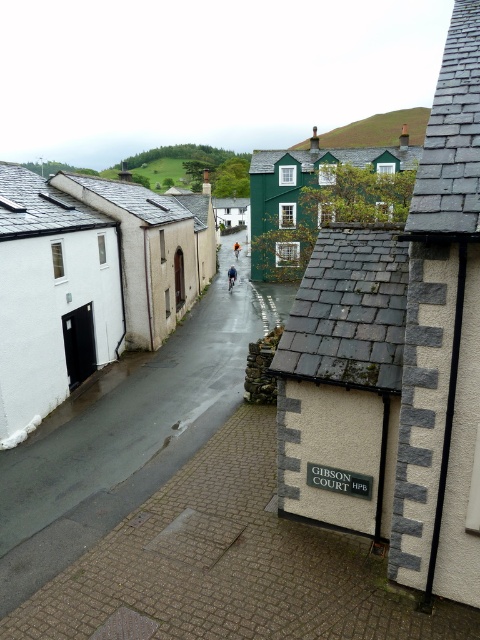
Question: Does blue fabric jacket at center lie behind orange fabric jacket at center?

Choices:
 (A) yes
 (B) no

Answer: (B)

Question: In this image, where is smooth asphalt road at center located relative to orange fabric jacket at center?

Choices:
 (A) right
 (B) left

Answer: (A)

Question: Which object is positioned farthest from the orange fabric jacket at center?

Choices:
 (A) smooth asphalt road at center
 (B) blue fabric jacket at center

Answer: (A)

Question: Which object appears closest to the camera in this image?

Choices:
 (A) orange fabric jacket at center
 (B) smooth asphalt road at center

Answer: (B)

Question: Which point is farther to the camera?

Choices:
 (A) (17, 508)
 (B) (231, 266)
 (C) (238, 250)

Answer: (C)

Question: Does smooth asphalt road at center come in front of blue fabric jacket at center?

Choices:
 (A) yes
 (B) no

Answer: (A)